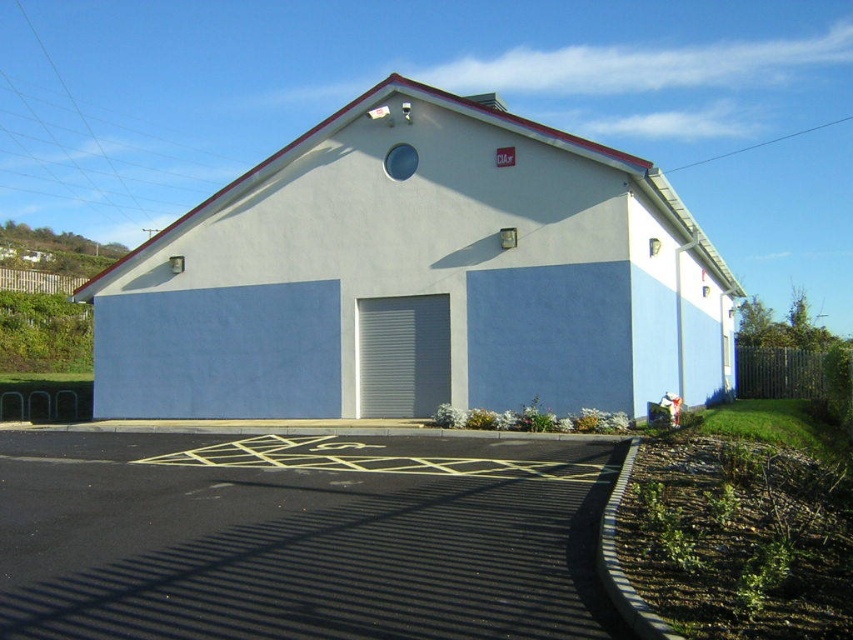
Question: Is white matte garage door at center behind gray metallic garage door at center?

Choices:
 (A) no
 (B) yes

Answer: (A)

Question: Observing the image, what is the correct spatial positioning of white matte garage door at center in reference to gray metallic garage door at center?

Choices:
 (A) left
 (B) right

Answer: (B)

Question: Observing the image, what is the correct spatial positioning of white matte garage door at center in reference to gray metallic garage door at center?

Choices:
 (A) right
 (B) left

Answer: (A)

Question: Among these objects, which one is nearest to the camera?

Choices:
 (A) gray metallic garage door at center
 (B) white matte garage door at center

Answer: (B)

Question: Which object appears farthest from the camera in this image?

Choices:
 (A) white matte garage door at center
 (B) gray metallic garage door at center

Answer: (B)